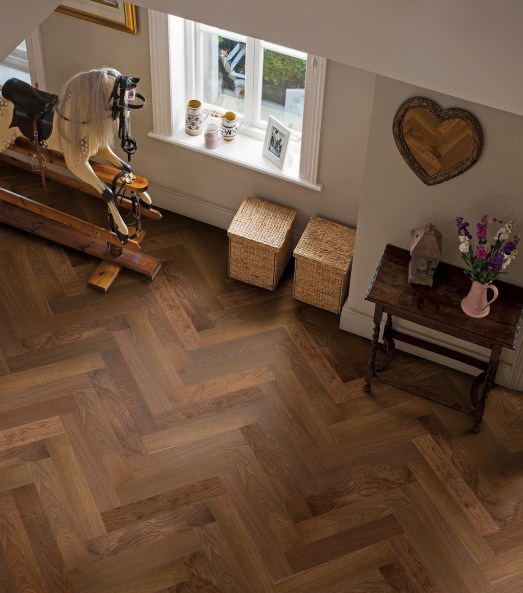
Where is `window sill`? The height and width of the screenshot is (593, 523). window sill is located at coordinates (244, 153).